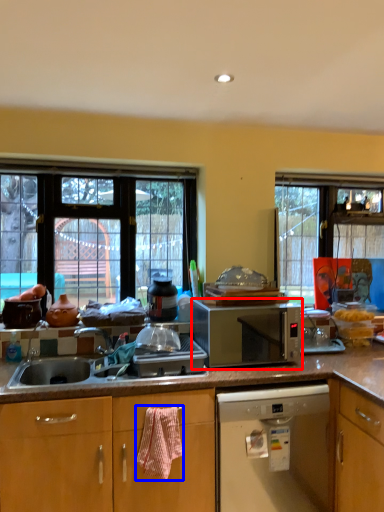
Question: Which object appears closest to the camera in this image, microwave oven (highlighted by a red box) or material (highlighted by a blue box)?

Choices:
 (A) microwave oven
 (B) material

Answer: (B)